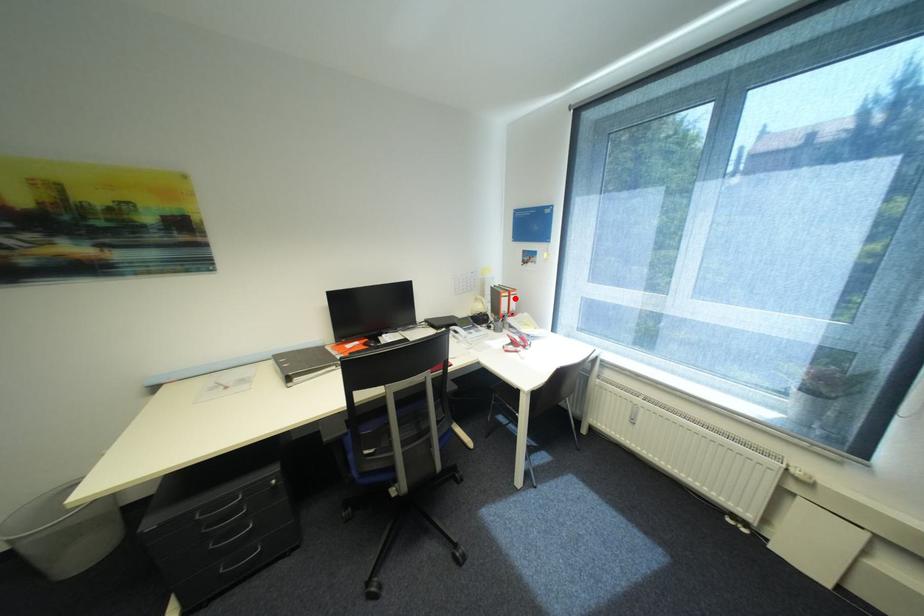
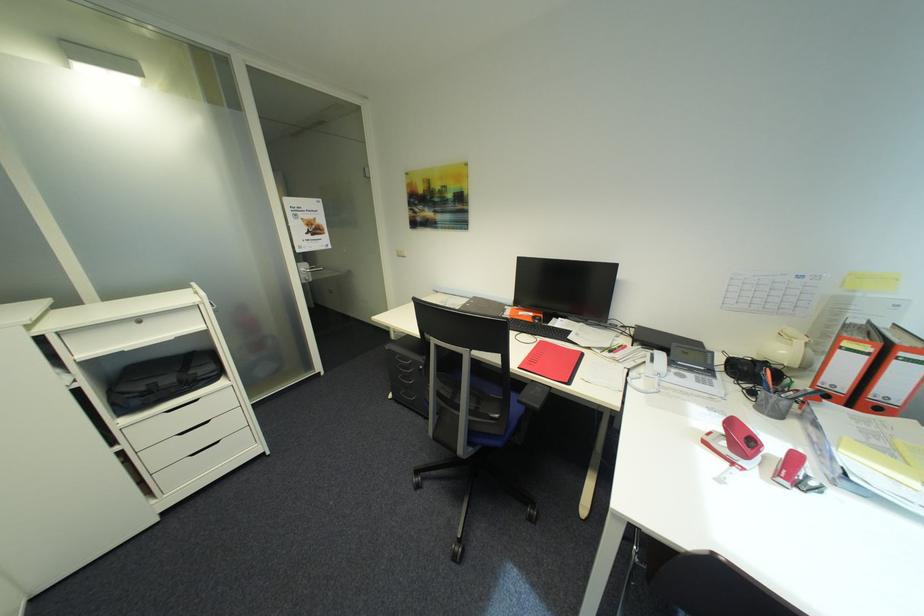
Find the pixel in the second image that matches the highlighted location in the first image.

(872, 359)